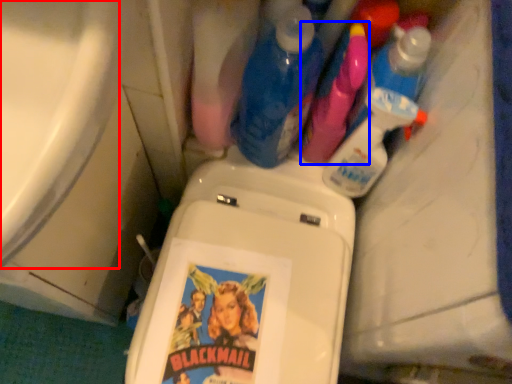
Question: Which object is further to the camera taking this photo, bath (highlighted by a red box) or cleaning product (highlighted by a blue box)?

Choices:
 (A) bath
 (B) cleaning product

Answer: (B)